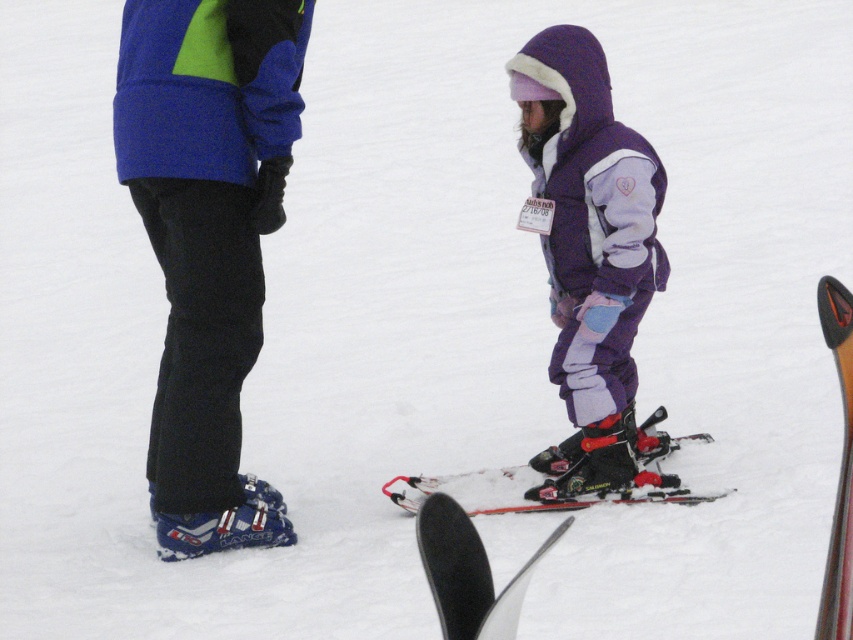
Based on the photo, you are a ski instructor assessing equipment for a beginner class. You have two items in view, the blue matte ski boots at lower left and the shiny black ski at lower right. Which item is taller?

The blue matte ski boots at lower left are taller than the shiny black ski at lower right.

You are a ski instructor preparing to distribute equipment to a group of students. You have the blue matte ski boots at lower left and the black matte ski at lower center. Which equipment piece is bigger in size?

The blue matte ski boots at lower left are larger in size than the black matte ski at lower center according to the description.